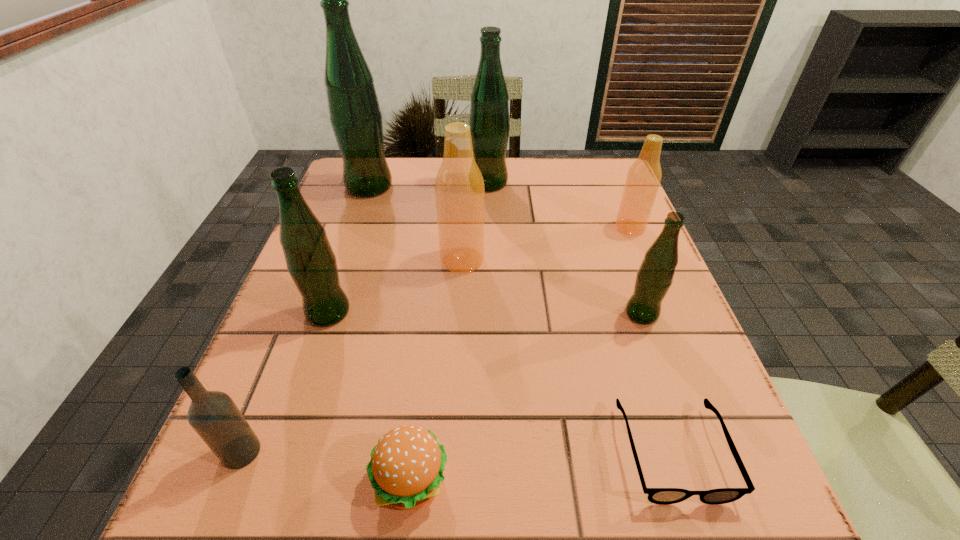
Where is `vacant region between the hamburger and the rightmost green beer bottle`? The width and height of the screenshot is (960, 540). vacant region between the hamburger and the rightmost green beer bottle is located at coordinates (526, 398).

Where is `free area in between the left tan beer bottle and the spectacles`? Image resolution: width=960 pixels, height=540 pixels. free area in between the left tan beer bottle and the spectacles is located at coordinates (567, 356).

Identify the location of free space between the smallest green beer bottle and the spectacles. (657, 383).

Point out which object is positioned as the sixth nearest to the seventh tallest object. Please provide its 2D coordinates. Your answer should be formatted as a tuple, i.e. [(x, y)], where the tuple contains the x and y coordinates of a point satisfying the conditions above.

[(354, 112)]

I want to click on the eighth closest object to the second tallest beer bottle, so click(214, 416).

Locate which beer bottle is the third closest to the hamburger. Please provide its 2D coordinates. Your answer should be formatted as a tuple, i.e. [(x, y)], where the tuple contains the x and y coordinates of a point satisfying the conditions above.

[(654, 278)]

Select which beer bottle is the second closest to the smallest green beer bottle. Please provide its 2D coordinates. Your answer should be formatted as a tuple, i.e. [(x, y)], where the tuple contains the x and y coordinates of a point satisfying the conditions above.

[(459, 186)]

The width and height of the screenshot is (960, 540). What are the coordinates of `green beer bottle that is the third closest to the nearer tan beer bottle` in the screenshot? It's located at (354, 112).

Point out which green beer bottle is positioned as the second nearest to the spectacles. Please provide its 2D coordinates. Your answer should be formatted as a tuple, i.e. [(x, y)], where the tuple contains the x and y coordinates of a point satisfying the conditions above.

[(311, 262)]

At what (x,y) coordinates should I click in order to perform the action: click on free space that satisfies the following two spatial constraints: 1. on the front side of the seventh tallest object; 2. on the right side of the second shortest object. Please return your answer as a coordinate pair (x, y). The image size is (960, 540). Looking at the image, I should click on (229, 482).